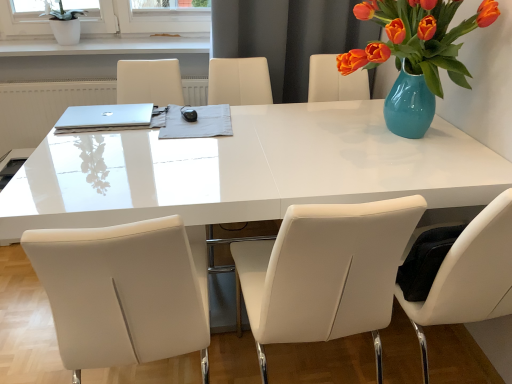
Question: Is white ceramic pot at upper left positioned behind gray fabric at center?

Choices:
 (A) yes
 (B) no

Answer: (A)

Question: Considering the relative positions of white ceramic pot at upper left and gray fabric at center in the image provided, is white ceramic pot at upper left to the left of gray fabric at center from the viewer's perspective?

Choices:
 (A) no
 (B) yes

Answer: (B)

Question: Are white ceramic pot at upper left and gray fabric at center located far from each other?

Choices:
 (A) no
 (B) yes

Answer: (B)

Question: Considering the relative sizes of white ceramic pot at upper left and gray fabric at center in the image provided, is white ceramic pot at upper left wider than gray fabric at center?

Choices:
 (A) no
 (B) yes

Answer: (A)

Question: Is white ceramic pot at upper left shorter than gray fabric at center?

Choices:
 (A) no
 (B) yes

Answer: (A)

Question: From a real-world perspective, is white ceramic pot at upper left below gray fabric at center?

Choices:
 (A) yes
 (B) no

Answer: (B)

Question: Is silver metallic laptop at upper left bigger than white glossy table at center?

Choices:
 (A) yes
 (B) no

Answer: (B)

Question: Is silver metallic laptop at upper left facing away from white glossy table at center?

Choices:
 (A) yes
 (B) no

Answer: (A)

Question: From the image's perspective, would you say silver metallic laptop at upper left is shown under white glossy table at center?

Choices:
 (A) yes
 (B) no

Answer: (B)

Question: Considering the relative sizes of silver metallic laptop at upper left and white glossy table at center in the image provided, is silver metallic laptop at upper left shorter than white glossy table at center?

Choices:
 (A) no
 (B) yes

Answer: (B)

Question: From the image's perspective, is silver metallic laptop at upper left on white glossy table at center?

Choices:
 (A) no
 (B) yes

Answer: (B)

Question: Are silver metallic laptop at upper left and white glossy table at center making contact?

Choices:
 (A) no
 (B) yes

Answer: (A)

Question: Considering the relative positions of white leather chair at center, placed as the first chair when sorted from right to left, and white leather chair at center, arranged as the first chair when viewed from the left, in the image provided, is white leather chair at center, placed as the first chair when sorted from right to left, behind white leather chair at center, arranged as the first chair when viewed from the left,?

Choices:
 (A) yes
 (B) no

Answer: (A)